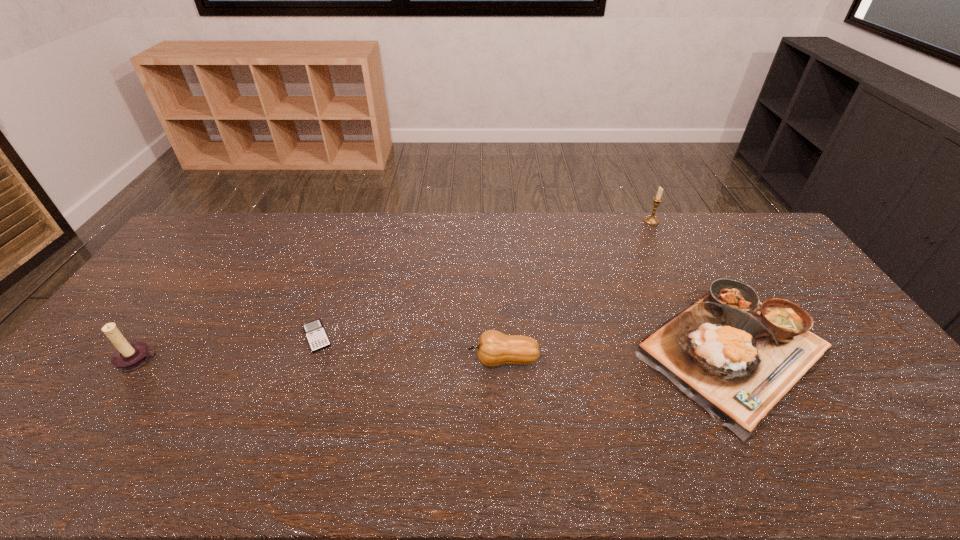
Locate an element on the screen. Image resolution: width=960 pixels, height=540 pixels. unoccupied area between the platter and the left candle holder is located at coordinates (437, 355).

The height and width of the screenshot is (540, 960). Find the location of `vacant region between the leftmost object and the farther candle holder`. vacant region between the leftmost object and the farther candle holder is located at coordinates (396, 291).

I want to click on free area in between the third object from right to left and the right candle holder, so click(577, 291).

Find the location of a particular element. This screenshot has width=960, height=540. free space between the platter and the farther candle holder is located at coordinates (693, 285).

At what (x,y) coordinates should I click in order to perform the action: click on vacant area between the second object from left to right and the leftmost object. Please return your answer as a coordinate pair (x, y). Looking at the image, I should click on tap(228, 348).

Choose which object is the nearest neighbor to the third object from left to right. Please provide its 2D coordinates. Your answer should be formatted as a tuple, i.e. [(x, y)], where the tuple contains the x and y coordinates of a point satisfying the conditions above.

[(736, 357)]

Identify the location of the third closest object to the calculator. [736, 357].

Locate an element on the screen. This screenshot has width=960, height=540. free location that satisfies the following two spatial constraints: 1. on the front side of the farthest object; 2. on the stem side of the third object from left to right is located at coordinates (720, 360).

The image size is (960, 540). Identify the location of blank space that satisfies the following two spatial constraints: 1. on the stem side of the third object from right to left; 2. on the wick of the nearer candle holder. (503, 360).

Find the location of a particular element. The image size is (960, 540). vacant space that satisfies the following two spatial constraints: 1. on the stem side of the gourd; 2. on the wick of the left candle holder is located at coordinates [503, 360].